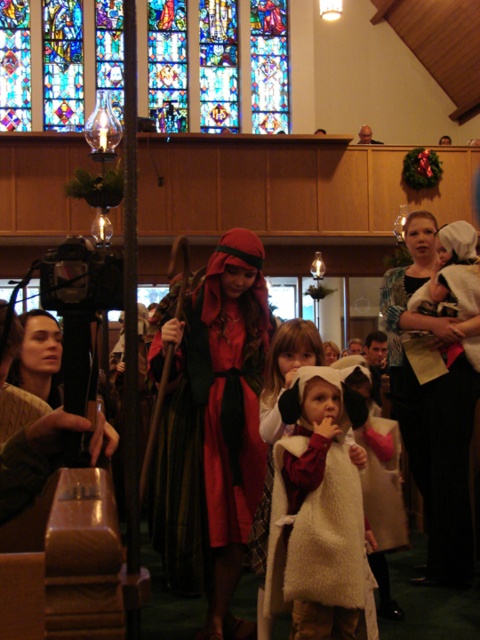
Question: Is white fluffy coat at center positioned behind white woolen scarf at center?

Choices:
 (A) no
 (B) yes

Answer: (A)

Question: Can you confirm if stained glass window at upper center is bigger than velvet red robe at center?

Choices:
 (A) no
 (B) yes

Answer: (B)

Question: Which of the following is the closest to the observer?

Choices:
 (A) (397, 333)
 (B) (257, 477)
 (C) (260, 124)

Answer: (B)

Question: Which object is closer to the camera taking this photo?

Choices:
 (A) white woolen scarf at center
 (B) velvet red robe at center

Answer: (B)

Question: Can you confirm if stained glass window at upper center is bigger than white fluffy coat at center?

Choices:
 (A) no
 (B) yes

Answer: (B)

Question: Estimate the real-world distances between objects in this image. Which object is closer to the white fluffy coat at center?

Choices:
 (A) white woolen scarf at center
 (B) velvet red robe at center

Answer: (B)